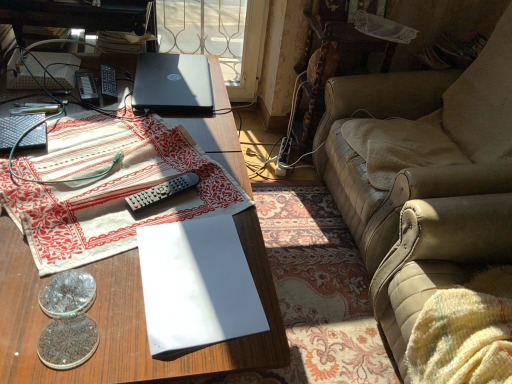
At what (x,y) coordinates should I click in order to perform the action: click on free space behind white paper at center, which is counted as the second paperback book, starting from the left. Please return your answer as a coordinate pair (x, y). Image resolution: width=512 pixels, height=384 pixels. Looking at the image, I should click on (199, 192).